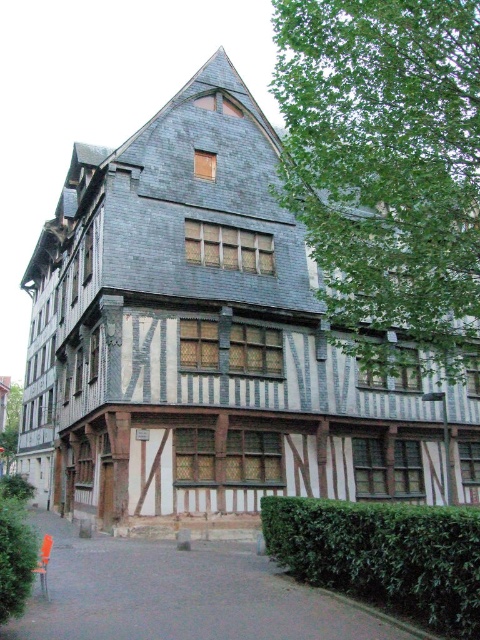
Question: Is green leafy hedge at lower right bigger than green leafy hedge at lower left?

Choices:
 (A) yes
 (B) no

Answer: (B)

Question: Which object appears farthest from the camera in this image?

Choices:
 (A) green leafy hedge at lower right
 (B) green leafy hedge at lower left

Answer: (A)

Question: In this image, where is green leafy hedge at lower right located relative to green leafy hedge at lower left?

Choices:
 (A) left
 (B) right

Answer: (B)

Question: Which of the following is the farthest from the observer?

Choices:
 (A) (25, 516)
 (B) (299, 532)

Answer: (A)

Question: Is green leafy hedge at lower right below green leafy hedge at lower left?

Choices:
 (A) yes
 (B) no

Answer: (B)

Question: Which point appears closest to the camera in this image?

Choices:
 (A) (25, 554)
 (B) (271, 557)

Answer: (A)